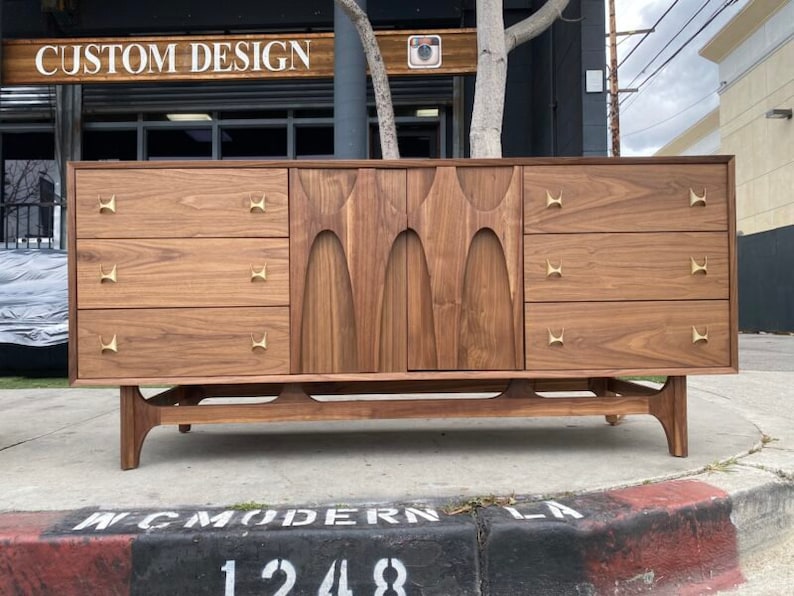
You are a GUI agent. You are given a task and a screenshot of the screen. Output one action in this format:
    pyautogui.click(x=<x>, y=<y>)
    Task: Click on the brown wooden dresser or sideboard
    The width and height of the screenshot is (794, 596).
    Given the screenshot: What is the action you would take?
    pyautogui.click(x=210, y=213)